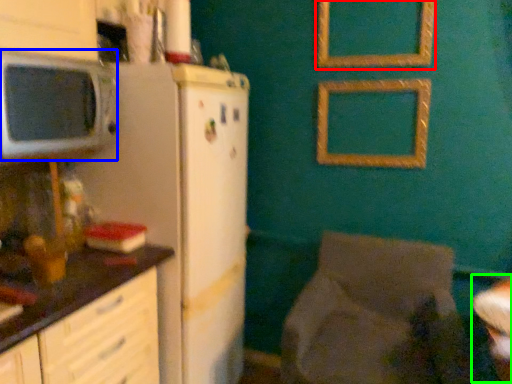
Question: Estimate the real-world distances between objects in this image. Which object is closer to picture frame (highlighted by a red box), microwave oven (highlighted by a blue box) or table (highlighted by a green box)?

Choices:
 (A) microwave oven
 (B) table

Answer: (B)